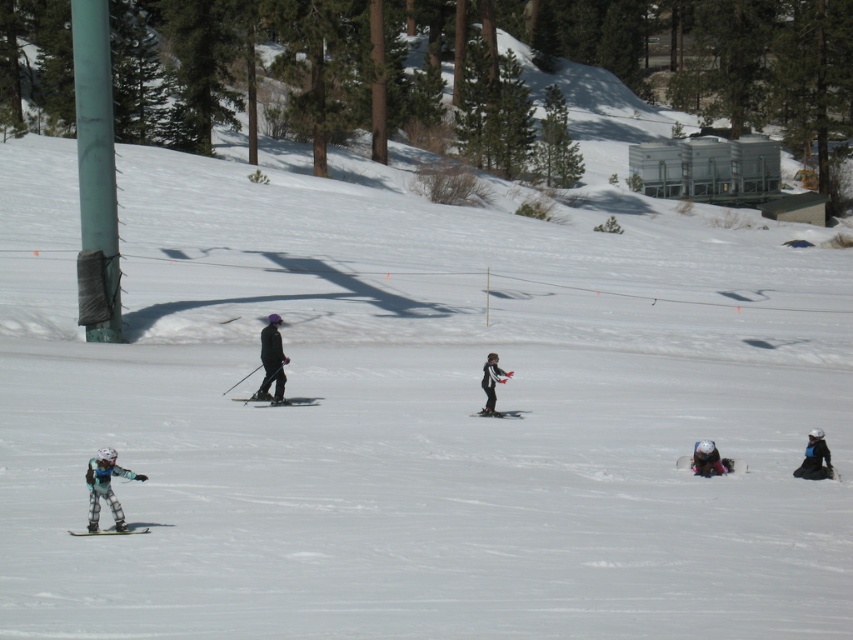
You are a ski instructor observing the scene. You notice two skiers wearing matte gray ski suit at lower left and dark gray ski suit at center. Which skier is shorter in height?

The matte gray ski suit at lower left has a lesser height compared to dark gray ski suit at center, so the skier in matte gray ski suit at lower left is shorter.

You are a photographer trying to capture a photo of the matte black ski at lower left and the matte black ski at center. Which ski should you focus on first if you want to include both in your shot without moving the camera?

You should focus on the matte black ski at lower left first because it is positioned below the matte black ski at center, so capturing it first ensures both are in frame without needing to adjust the camera angle.